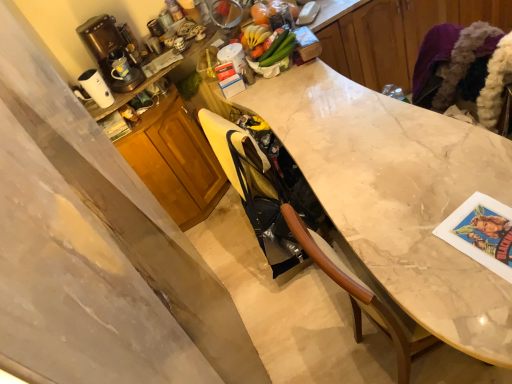
Question: Is white glossy electric kettle at upper left inside the boundaries of wooden cabinet at center, positioned as the first cabinetry in left-to-right order, or outside?

Choices:
 (A) outside
 (B) inside

Answer: (A)

Question: Looking at their shapes, would you say white glossy electric kettle at upper left is wider or thinner than wooden cabinet at center, which is the second cabinetry in right-to-left order?

Choices:
 (A) thin
 (B) wide

Answer: (A)

Question: Based on their relative distances, which object is farther from the white glossy electric kettle at upper left?

Choices:
 (A) black leather swivel chair at center
 (B) marble at center
 (C) brown plastic coffee machine at upper left
 (D) white marble countertop at center, the first cabinetry viewed from the top
 (E) wooden cabinet at center, marked as the second cabinetry in a top-to-bottom arrangement

Answer: (D)

Question: Based on their relative distances, which object is nearer to the black leather swivel chair at center?

Choices:
 (A) white marble countertop at center, the first cabinetry viewed from the top
 (B) wooden cabinet at center, which is the 1th cabinetry from bottom to top
 (C) brown plastic coffee machine at upper left
 (D) marble at center
 (E) white glossy electric kettle at upper left

Answer: (D)